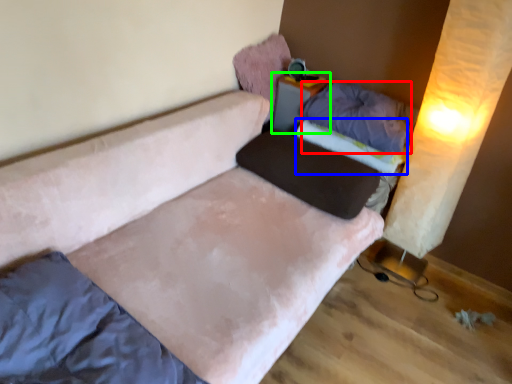
Question: Estimate the real-world distances between objects in this image. Which object is closer to pillow (highlighted by a red box), mattress (highlighted by a blue box) or table (highlighted by a green box)?

Choices:
 (A) mattress
 (B) table

Answer: (A)